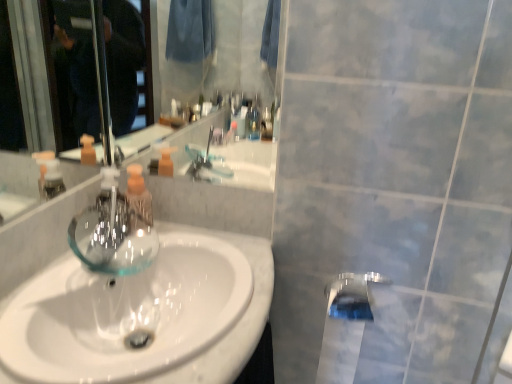
Locate an element on the screen. free location to the right of clear glass faucet at center is located at coordinates (159, 241).